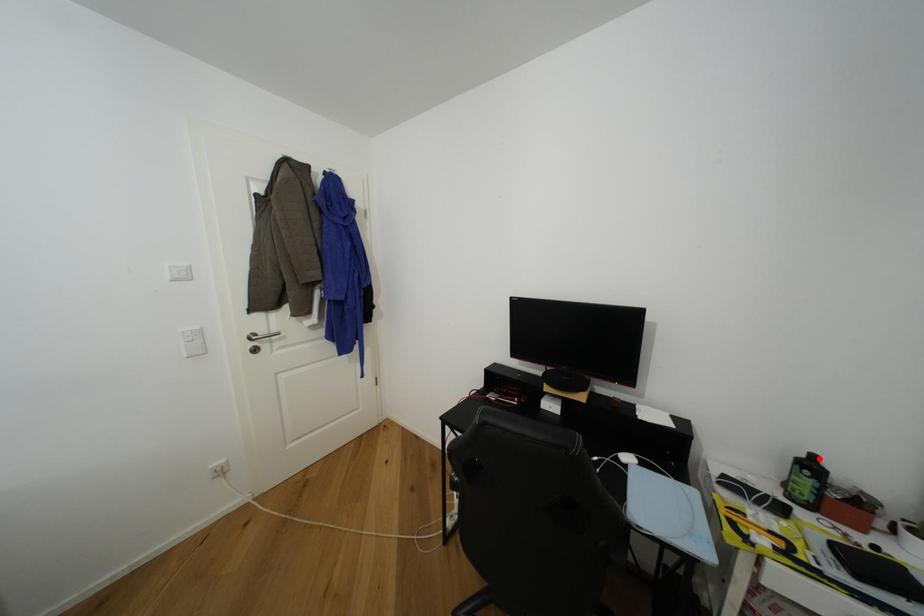
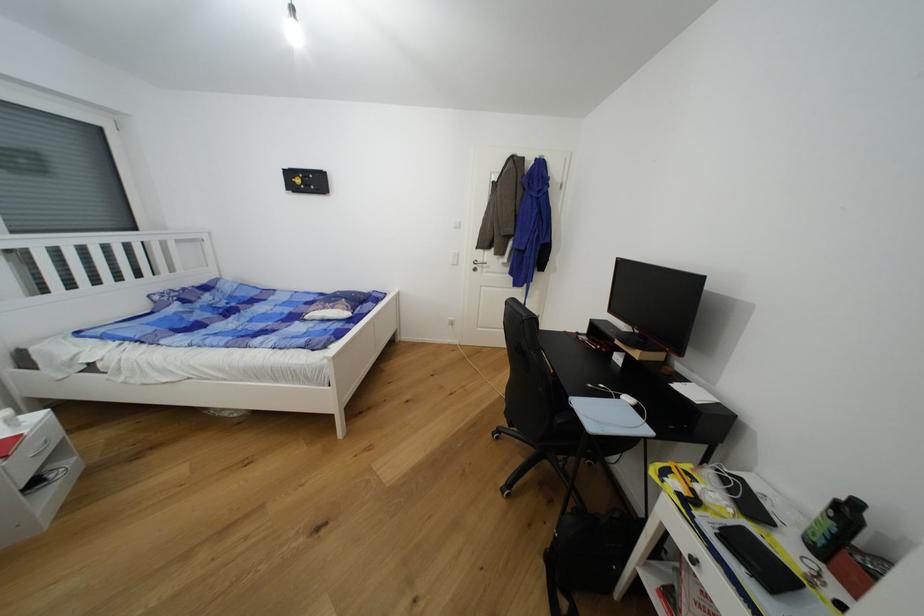
Where in the second image is the point corresponding to the highlighted location from the first image?

(862, 506)